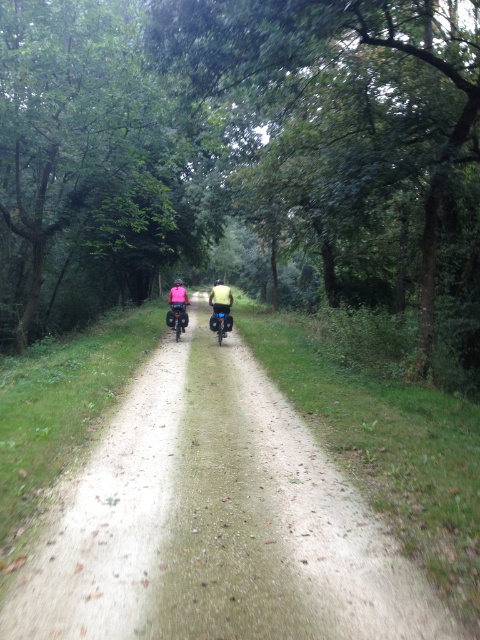
You are planning to set up a small picnic area between the green leafy tree at center and the dirt path at center. Given that the picnic blanket requires a space of 10 meters in length, will there be enough space between them?

The distance between the green leafy tree at center and dirt path at center is 12.36 meters, which is more than enough to accommodate the 10 meters required for the picnic blanket.

You are a drone operator trying to capture the cyclists from above. You have two points marked on your screen, point A at coordinates point [170,506] and point B at coordinates point [214,305]. Which point is closer to your drone camera?

Point A at coordinates point [170,506] is closer to the camera than point B at coordinates point [214,305].